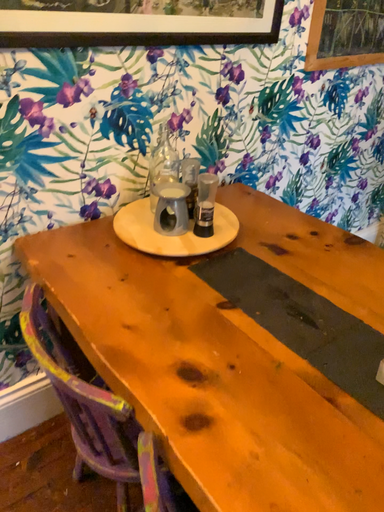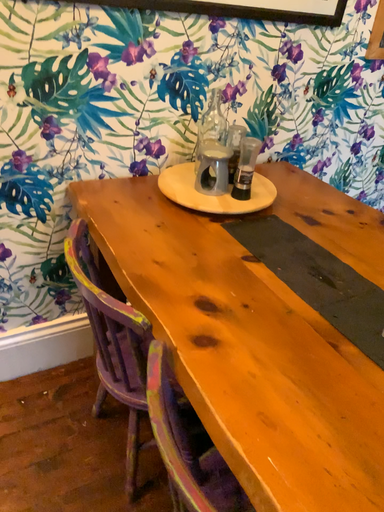
Question: Which way did the camera rotate in the video?

Choices:
 (A) rotated right
 (B) rotated left

Answer: (B)